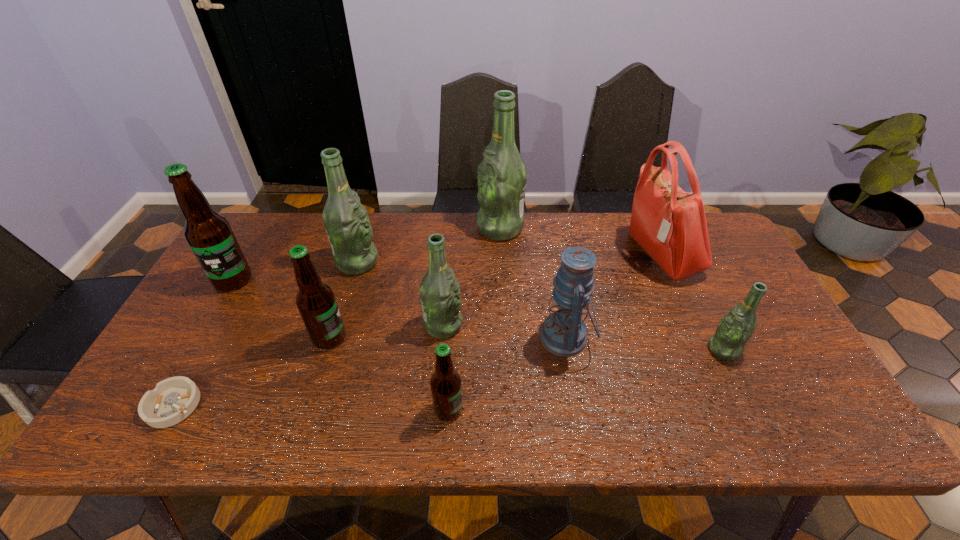
This screenshot has height=540, width=960. What are the coordinates of `free space between the leftmost brown beer bottle and the shortest object` in the screenshot? It's located at (204, 343).

This screenshot has width=960, height=540. Find the location of `vacant point located between the handbag and the third green beer bottle from right to left`. vacant point located between the handbag and the third green beer bottle from right to left is located at coordinates (552, 290).

Find the location of a particular element. This screenshot has height=540, width=960. vacant area between the nearest brown beer bottle and the rightmost green beer bottle is located at coordinates (586, 380).

Find the location of a particular element. free space between the nearest beer bottle and the rightmost beer bottle is located at coordinates (586, 380).

At what (x,y) coordinates should I click in order to perform the action: click on free space between the third green beer bottle from right to left and the farthest beer bottle. Please return your answer as a coordinate pair (x, y). Image resolution: width=960 pixels, height=540 pixels. Looking at the image, I should click on [471, 276].

Identify the location of free point between the rightmost green beer bottle and the second farthest green beer bottle. Image resolution: width=960 pixels, height=540 pixels. (540, 306).

The height and width of the screenshot is (540, 960). What are the coordinates of `object that ranks as the fourth closest to the biggest brown beer bottle` in the screenshot? It's located at (439, 291).

Where is `the sixth closest object relative to the smallest brown beer bottle`? This screenshot has height=540, width=960. the sixth closest object relative to the smallest brown beer bottle is located at coordinates (502, 175).

Locate which beer bottle ranks sixth in proximity to the sixth beer bottle from left to right. Please provide its 2D coordinates. Your answer should be formatted as a tuple, i.e. [(x, y)], where the tuple contains the x and y coordinates of a point satisfying the conditions above.

[(209, 235)]

Locate an element on the screen. The image size is (960, 540). beer bottle that is the closest to the leftmost green beer bottle is located at coordinates (316, 302).